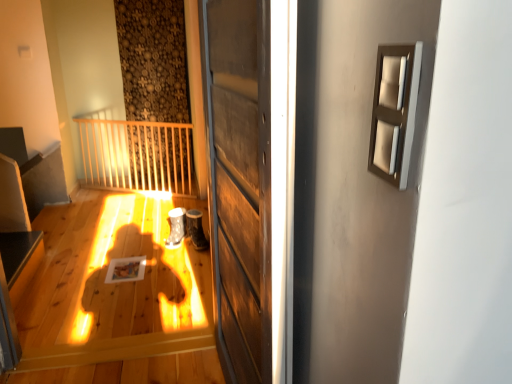
Question: From the image's perspective, would you say smooth black surface at lower left is positioned over satin beige frame at upper right?

Choices:
 (A) no
 (B) yes

Answer: (A)

Question: Does smooth black surface at lower left have a smaller size compared to satin beige frame at upper right?

Choices:
 (A) yes
 (B) no

Answer: (B)

Question: From a real-world perspective, is smooth black surface at lower left physically above satin beige frame at upper right?

Choices:
 (A) yes
 (B) no

Answer: (B)

Question: Is smooth black surface at lower left surrounding satin beige frame at upper right?

Choices:
 (A) yes
 (B) no

Answer: (B)

Question: Is smooth black surface at lower left wider than satin beige frame at upper right?

Choices:
 (A) no
 (B) yes

Answer: (B)

Question: Is wooden door at center taller or shorter than smooth black surface at lower left?

Choices:
 (A) tall
 (B) short

Answer: (A)

Question: Is wooden door at center in front of or behind smooth black surface at lower left in the image?

Choices:
 (A) front
 (B) behind

Answer: (A)

Question: Looking at their shapes, would you say wooden door at center is wider or thinner than smooth black surface at lower left?

Choices:
 (A) thin
 (B) wide

Answer: (A)

Question: Does point (248, 66) appear closer or farther from the camera than point (30, 238)?

Choices:
 (A) closer
 (B) farther

Answer: (A)

Question: Considering the positions of point (401, 139) and point (37, 238), is point (401, 139) closer or farther from the camera than point (37, 238)?

Choices:
 (A) closer
 (B) farther

Answer: (A)

Question: From the image's perspective, is satin beige frame at upper right above or below smooth black surface at lower left?

Choices:
 (A) above
 (B) below

Answer: (A)

Question: Is satin beige frame at upper right to the left or to the right of smooth black surface at lower left in the image?

Choices:
 (A) left
 (B) right

Answer: (B)

Question: Considering the positions of satin beige frame at upper right and smooth black surface at lower left in the image, is satin beige frame at upper right bigger or smaller than smooth black surface at lower left?

Choices:
 (A) big
 (B) small

Answer: (B)

Question: In the image, is smooth black surface at lower left positioned in front of or behind satin beige frame at upper right?

Choices:
 (A) behind
 (B) front

Answer: (A)

Question: Considering the positions of smooth black surface at lower left and satin beige frame at upper right in the image, is smooth black surface at lower left taller or shorter than satin beige frame at upper right?

Choices:
 (A) short
 (B) tall

Answer: (B)